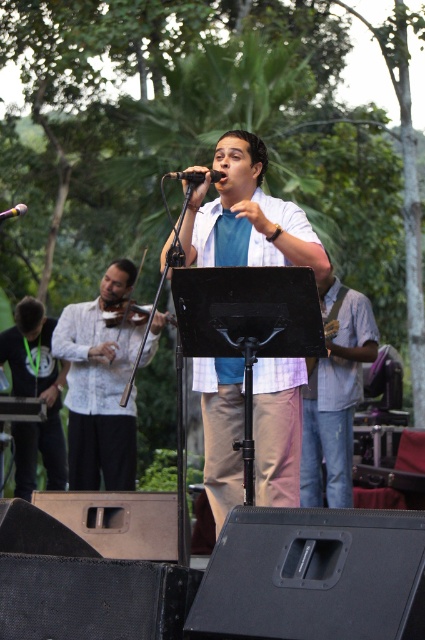
You are a photographer at the live performance. You want to take a photo of the black matte shirt at left and the wooden violin at center. Which object should you focus on first if you want to capture both in the same frame without moving the camera?

The black matte shirt at left is below the wooden violin at center, so you should focus on the wooden violin at center first to ensure both are in the frame.

You are a photographer at the event and want to ensure that both the black matte shirt at left and the wooden violin at center are clearly visible in your photo. Given their sizes, which object should you focus on first to ensure proper focus?

The black matte shirt at left has a larger size compared to the wooden violin at center, so focusing on the black matte shirt at left first would ensure proper focus since larger objects often require more precise focusing to capture details.